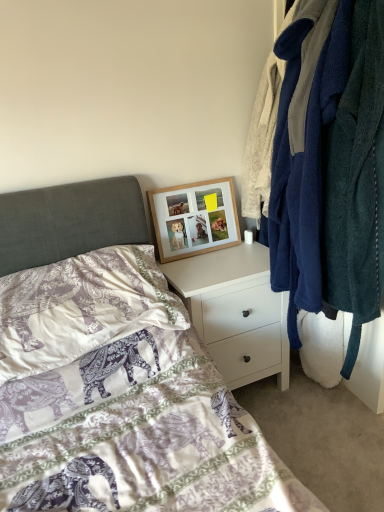
Identify the location of vacant area on top of white matte nightstand at upper center (from a real-world perspective). The height and width of the screenshot is (512, 384). [215, 258].